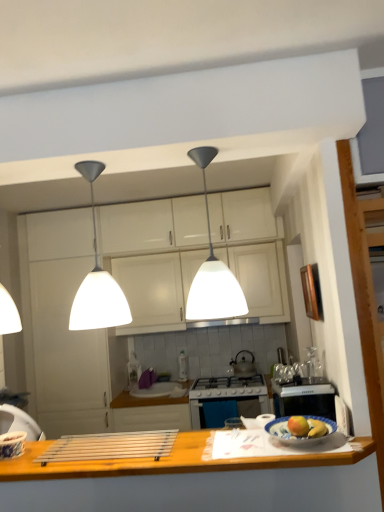
The height and width of the screenshot is (512, 384). In order to click on vacant space to the left of blue glossy plate at lower right in this screenshot , I will do (x=243, y=441).